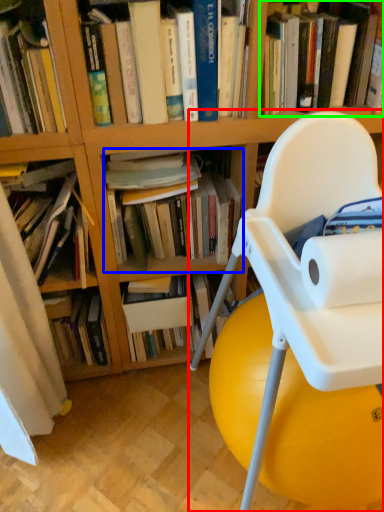
Question: Which object is positioned closest to chair (highlighted by a red box)? Select from book (highlighted by a blue box) and book (highlighted by a green box).

Choices:
 (A) book
 (B) book

Answer: (A)